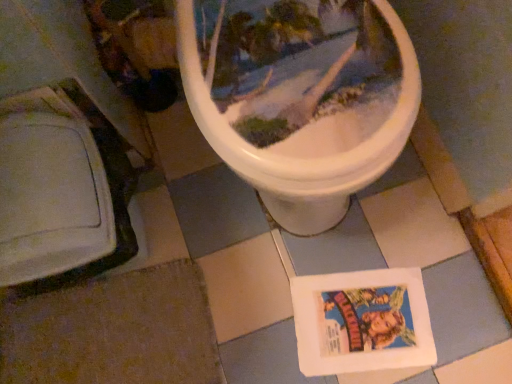
Find the location of `vacant space to the right of white paper comic book at lower center`. vacant space to the right of white paper comic book at lower center is located at coordinates (451, 296).